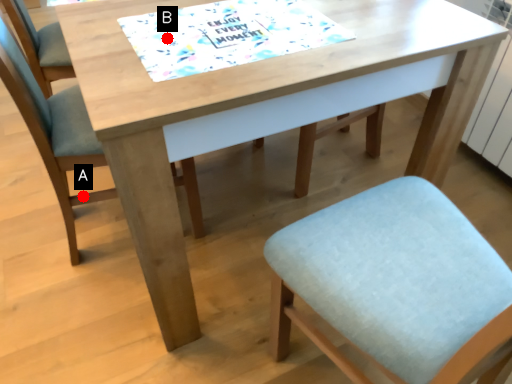
Question: Two points are circled on the image, labeled by A and B beside each circle. Which point appears farthest from the camera in this image?

Choices:
 (A) A is further
 (B) B is further

Answer: (A)